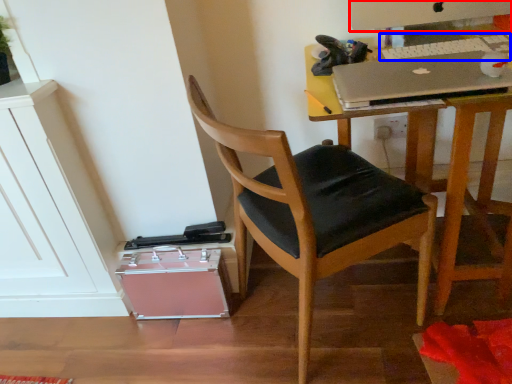
Question: Which object appears closest to the camera in this image, computer monitor (highlighted by a red box) or laptop keyboard (highlighted by a blue box)?

Choices:
 (A) computer monitor
 (B) laptop keyboard

Answer: (B)